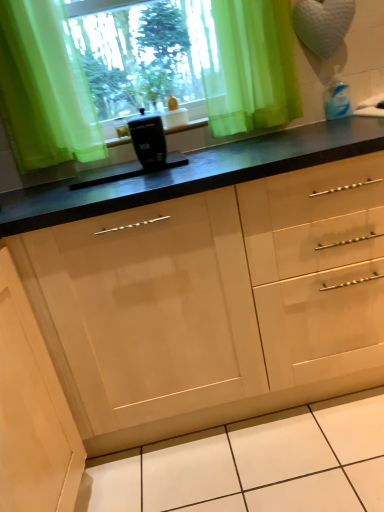
Question: Does green sheer curtain at upper center appear on the right side of translucent green curtain at upper center?

Choices:
 (A) no
 (B) yes

Answer: (A)

Question: From a real-world perspective, is green sheer curtain at upper center on translucent green curtain at upper center?

Choices:
 (A) no
 (B) yes

Answer: (B)

Question: Does green sheer curtain at upper center appear on the left side of translucent green curtain at upper center?

Choices:
 (A) yes
 (B) no

Answer: (A)

Question: Can you confirm if green sheer curtain at upper center is taller than translucent green curtain at upper center?

Choices:
 (A) yes
 (B) no

Answer: (A)

Question: Can you confirm if green sheer curtain at upper center is shorter than translucent green curtain at upper center?

Choices:
 (A) yes
 (B) no

Answer: (B)

Question: Is green sheer curtain at upper center not within translucent green curtain at upper center?

Choices:
 (A) no
 (B) yes

Answer: (B)

Question: Does translucent green curtain at upper center have a smaller size compared to black plastic container at center?

Choices:
 (A) yes
 (B) no

Answer: (B)

Question: From the image's perspective, is translucent green curtain at upper center over black plastic container at center?

Choices:
 (A) no
 (B) yes

Answer: (B)

Question: Is translucent green curtain at upper center at the left side of black plastic container at center?

Choices:
 (A) no
 (B) yes

Answer: (A)

Question: Is translucent green curtain at upper center positioned beyond the bounds of black plastic container at center?

Choices:
 (A) yes
 (B) no

Answer: (A)

Question: Could you tell me if translucent green curtain at upper center is turned towards black plastic container at center?

Choices:
 (A) no
 (B) yes

Answer: (A)

Question: Is translucent green curtain at upper center not close to black plastic container at center?

Choices:
 (A) no
 (B) yes

Answer: (A)

Question: Considering the relative sizes of black plastic container at center and matte wood cabinet at lower left in the image provided, is black plastic container at center wider than matte wood cabinet at lower left?

Choices:
 (A) no
 (B) yes

Answer: (A)